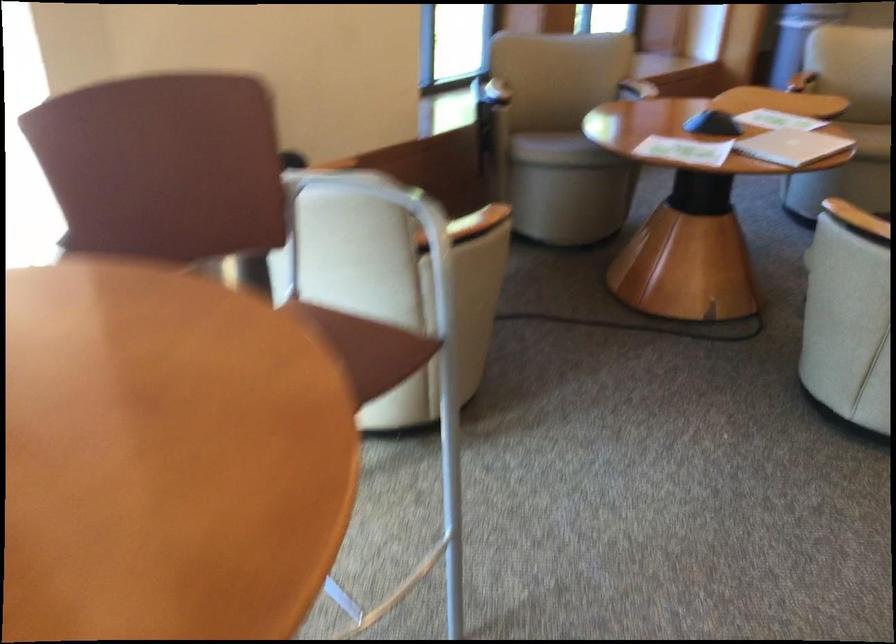
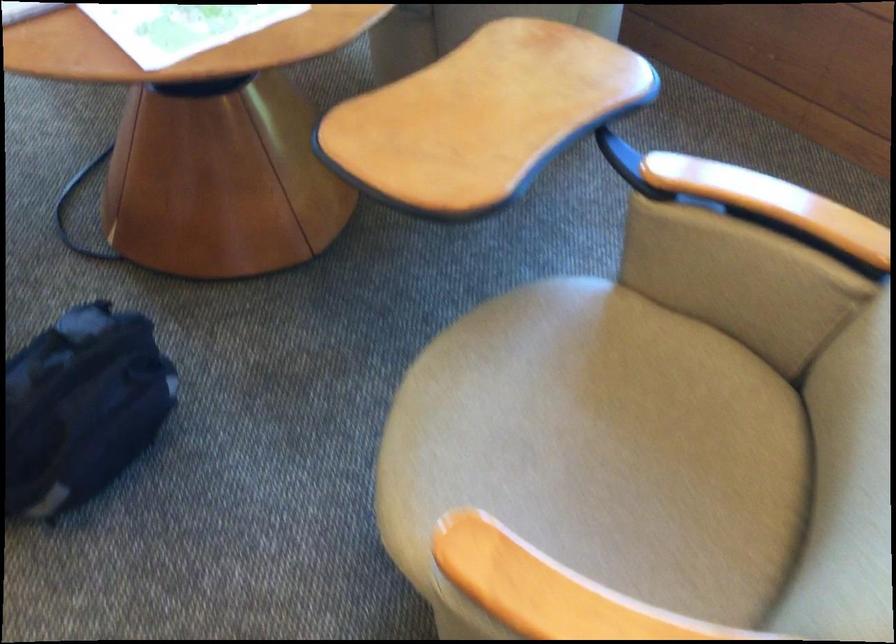
Question: I am providing you with two images of the same scene from different viewpoints. After the viewpoint changes to image2, which objects are now occluded?

Choices:
 (A) wooden chair armrest
 (B) pivoting wooden tray
 (C) black bag
 (D) paper map

Answer: (A)